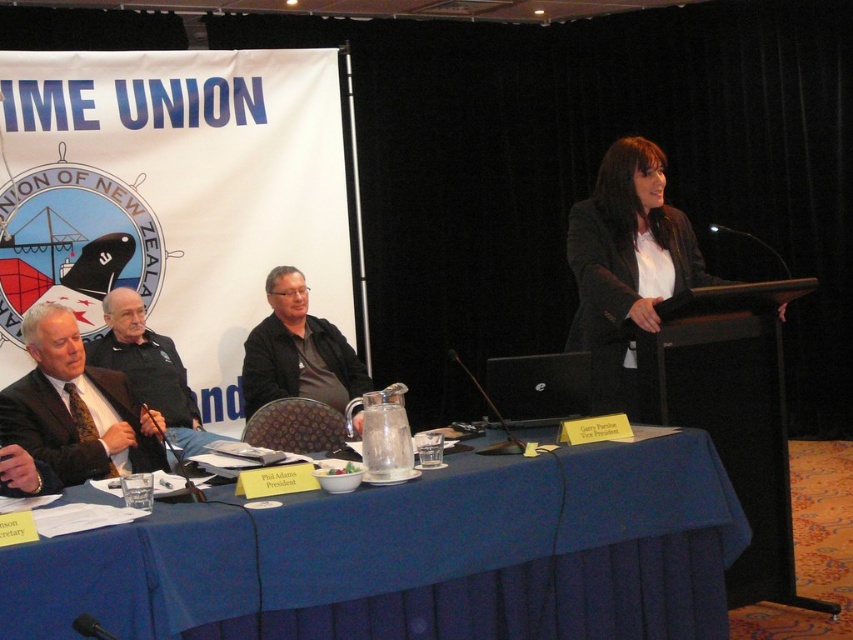
You are organizing a photo shoot for a fashion magazine and need to place two suits on a table. The matte black suit at left and the dark suit at left are both available. If you want to arrange them side by side so that the narrower one is on the left, which suit should you place on the left?

The matte black suit at left is thinner than the dark suit at left, so you should place the matte black suit at left on the left side to have the narrower one there.

You are attending the IME UNION event and notice two items at the center of the scene. Which one is nearer to you between the blue fabric table at center and the black leather jacket at center?

The blue fabric table at center is closer to you than the black leather jacket at center.